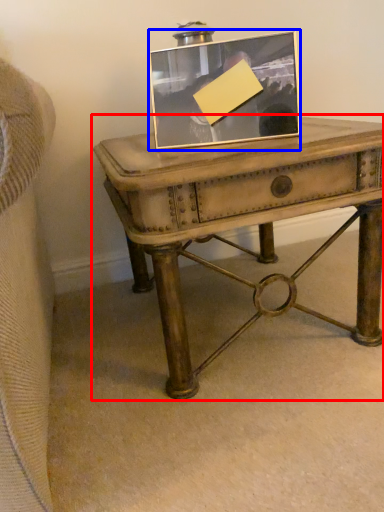
Question: Among these objects, which one is nearest to the camera, table (highlighted by a red box) or picture frame (highlighted by a blue box)?

Choices:
 (A) table
 (B) picture frame

Answer: (A)